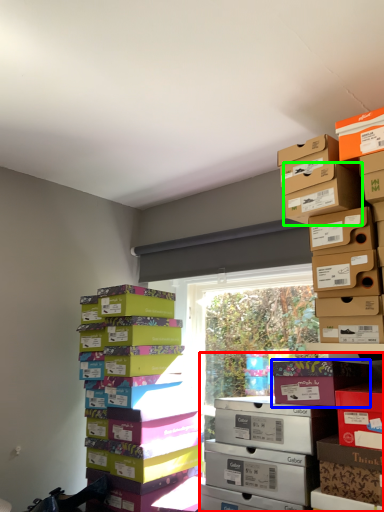
Question: Which object is positioned farthest from shelf (highlighted by a red box)? Select from cardboard box (highlighted by a blue box) and cardboard box (highlighted by a green box).

Choices:
 (A) cardboard box
 (B) cardboard box

Answer: (B)